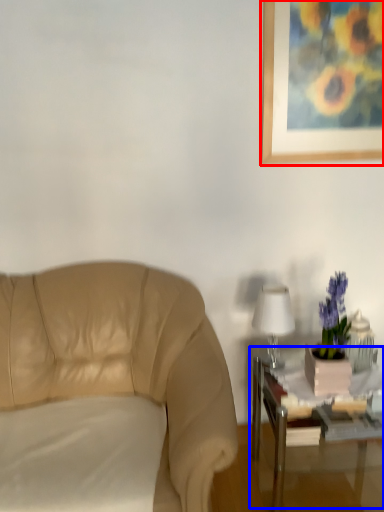
Question: Which point is closer to the camera, picture frame (highlighted by a red box) or table (highlighted by a blue box)?

Choices:
 (A) picture frame
 (B) table

Answer: (B)